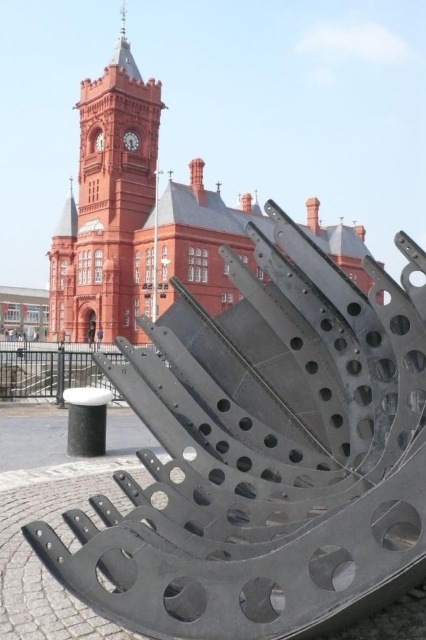
In the scene shown: You are standing at the camera position looking at the historic red brick building with a clock tower and the black metallic sculpture at center. If you want to take a photo that includes both the building and the sculpture, will you need to zoom in or out to ensure both are visible in the frame?

Since the black metallic sculpture at center is 40.96 meters away from the camera, you would need to zoom out to include both the historic red brick building with a clock tower and the sculpture in the same frame.

You are standing at the base of the historic red brick building with the clock tower. You want to take a photo of the clock tower without any obstructions. There is a black metallic sculpture at center located at point (x=267, y=456). Can you take the photo from your current position?

The black metallic sculpture at center is located at point (x=267, y=456), which is in front of the clock tower. Therefore, you cannot take a photo of the clock tower without the sculpture obstructing the view.

You are an architect analyzing the spatial relationship between the black metallic sculpture at center and the matte red clock tower at upper left. Based on their relative heights, which one would cast a longer shadow during midday when the sun is directly overhead?

The matte red clock tower at upper left is taller than the black metallic sculpture at center, so it would cast a longer shadow during midday when the sun is directly overhead.